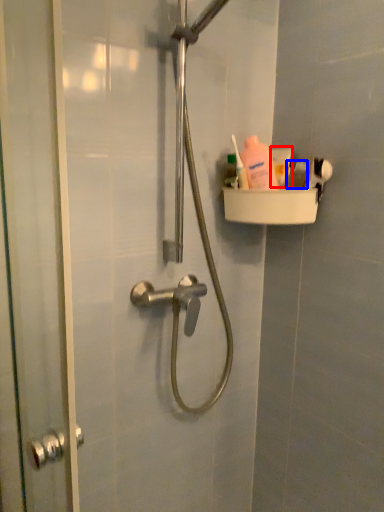
Question: Which object is closer to the camera taking this photo, toothpaste (highlighted by a red box) or toiletry (highlighted by a blue box)?

Choices:
 (A) toothpaste
 (B) toiletry

Answer: (B)